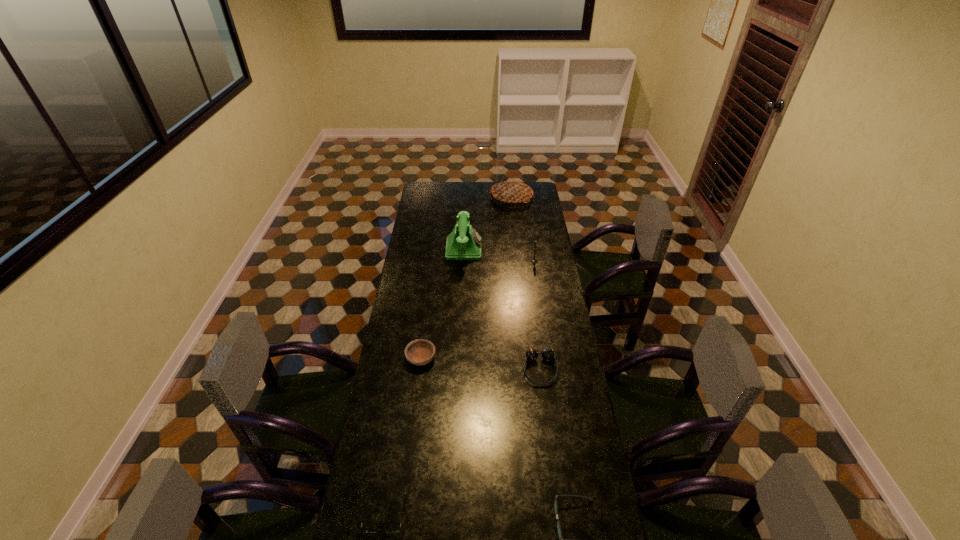
At what (x,y) coordinates should I click in order to perform the action: click on free region at the right edge of the desktop. Please return your answer as a coordinate pair (x, y). This screenshot has height=540, width=960. Looking at the image, I should click on (543, 259).

Image resolution: width=960 pixels, height=540 pixels. In the image, there is a desktop. What are the coordinates of `free space at the far left corner` in the screenshot? It's located at (426, 183).

Locate an element on the screen. The image size is (960, 540). empty space between the shorter spectacles and the bowl is located at coordinates (x=402, y=437).

You are a GUI agent. You are given a task and a screenshot of the screen. Output one action in this format:
    pyautogui.click(x=<x>, y=<y>)
    Task: Click on the free space that is in between the bowl and the farthest object
    
    Given the screenshot: What is the action you would take?
    pyautogui.click(x=466, y=278)

You are a GUI agent. You are given a task and a screenshot of the screen. Output one action in this format:
    pyautogui.click(x=<x>, y=<y>)
    Task: Click on the vacant point located between the goggles and the bowl
    The image size is (960, 540).
    Given the screenshot: What is the action you would take?
    pyautogui.click(x=480, y=364)

Where is `vacant space that is in between the bowl and the telephone`? The width and height of the screenshot is (960, 540). vacant space that is in between the bowl and the telephone is located at coordinates (443, 303).

Where is `free space that is in between the telephone and the fifth shortest object`? free space that is in between the telephone and the fifth shortest object is located at coordinates (499, 255).

At what (x,y) coordinates should I click in order to perform the action: click on free space between the telephone and the bowl. Please return your answer as a coordinate pair (x, y). This screenshot has width=960, height=540. Looking at the image, I should click on (443, 303).

Where is `object that is the second closest to the right spectacles`? Image resolution: width=960 pixels, height=540 pixels. object that is the second closest to the right spectacles is located at coordinates (x=364, y=529).

Locate an element on the screen. This screenshot has height=540, width=960. object that stands as the third closest to the fourth shortest object is located at coordinates (364, 529).